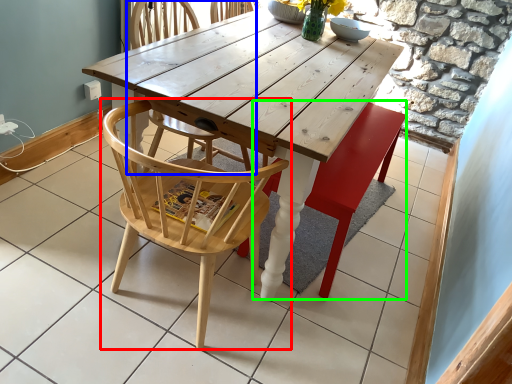
Question: Considering the real-world distances, which object is closest to chair (highlighted by a red box)? chair (highlighted by a blue box) or swivel chair (highlighted by a green box).

Choices:
 (A) chair
 (B) swivel chair

Answer: (B)